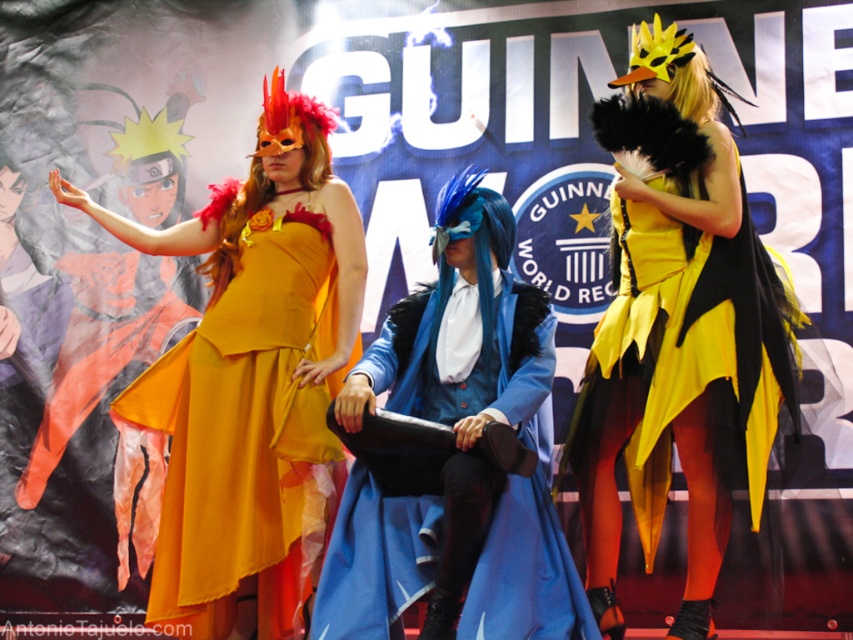
You are standing in front of the Guinness World Records backdrop and see two points marked in the image. Which point is closer to you, point [253,253] or point [788,381]?

Point [253,253] is closer to you than point [788,381].